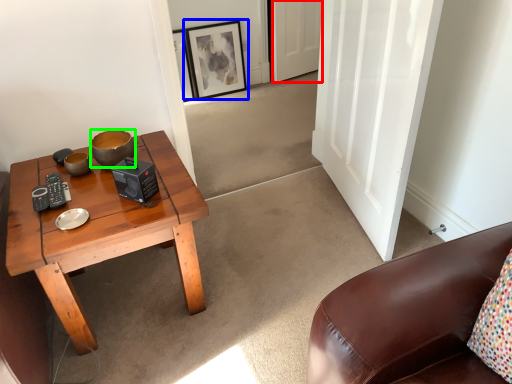
Question: Estimate the real-world distances between objects in this image. Which object is closer to door (highlighted by a red box), picture frame (highlighted by a blue box) or bowl (highlighted by a green box)?

Choices:
 (A) picture frame
 (B) bowl

Answer: (A)